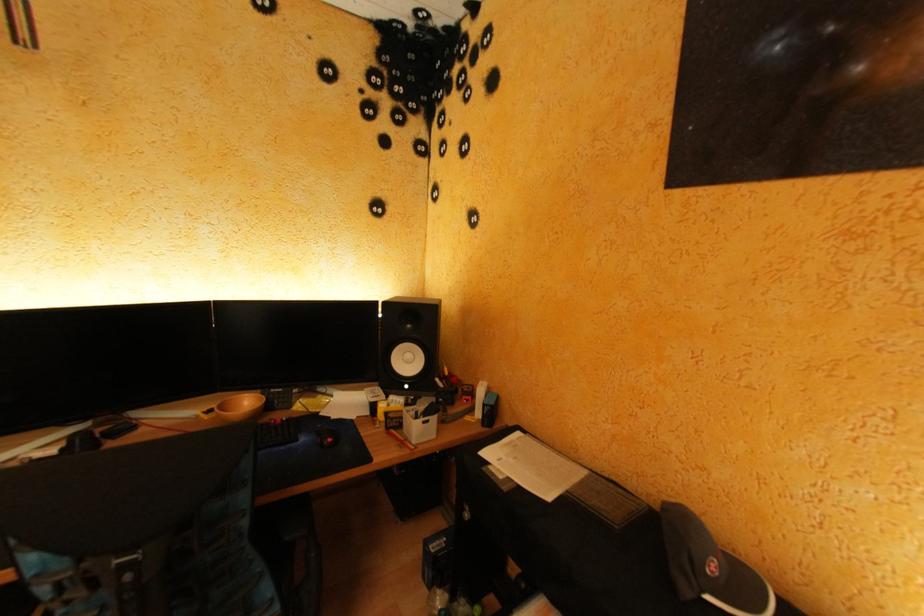
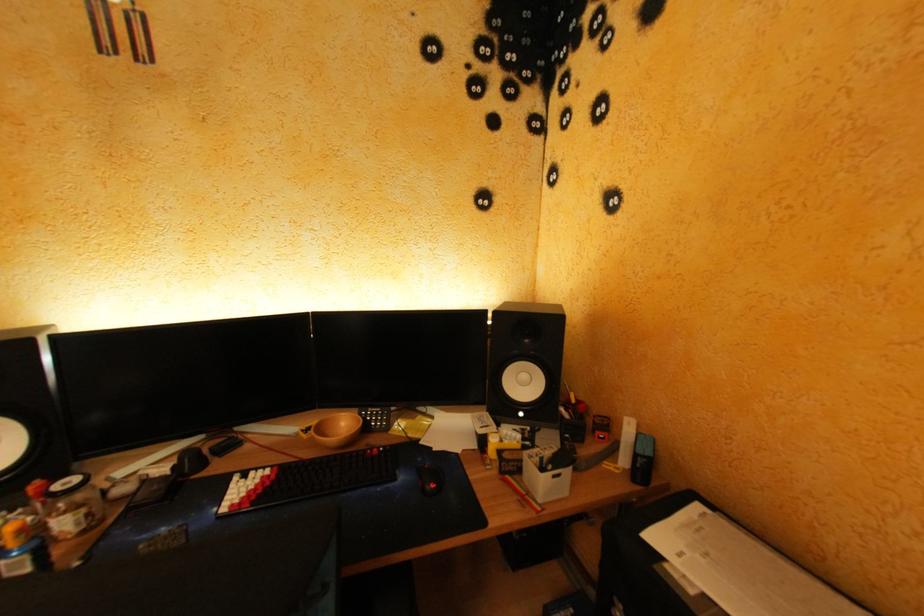
Question: The camera is either moving clockwise (left) or counter-clockwise (right) around the object. The first image is from the beginning of the video and the second image is from the end. Is the camera moving left or right when shooting the video?

Choices:
 (A) Left
 (B) Right

Answer: (B)